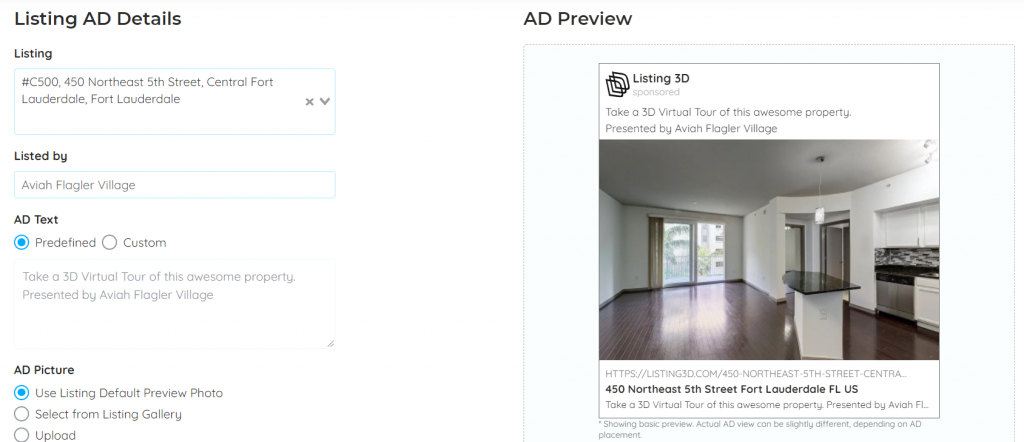
Image resolution: width=1024 pixels, height=442 pixels. Find the location of `counter`. counter is located at coordinates (818, 277).